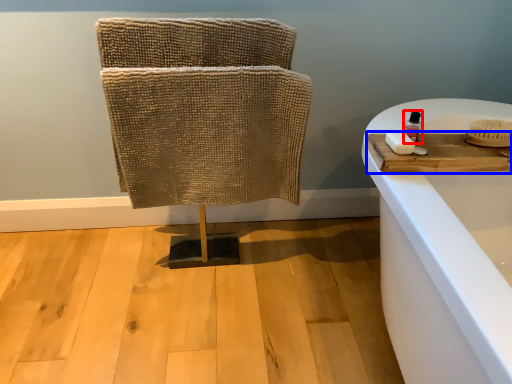
Question: Which object is closer to the camera taking this photo, toiletry (highlighted by a red box) or wood (highlighted by a blue box)?

Choices:
 (A) toiletry
 (B) wood

Answer: (B)